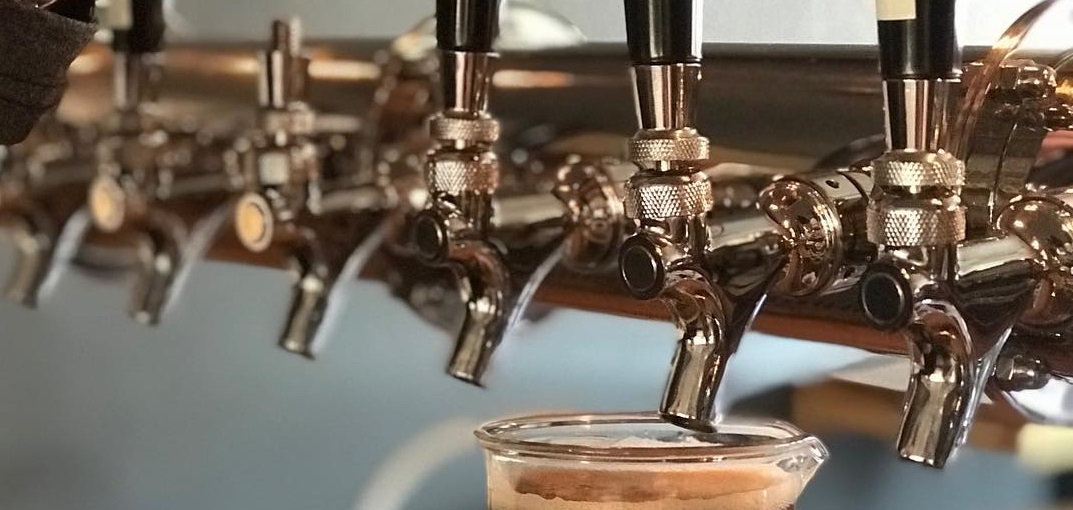
I want to click on wall, so click(161, 413), click(317, 429), click(70, 396), click(632, 369).